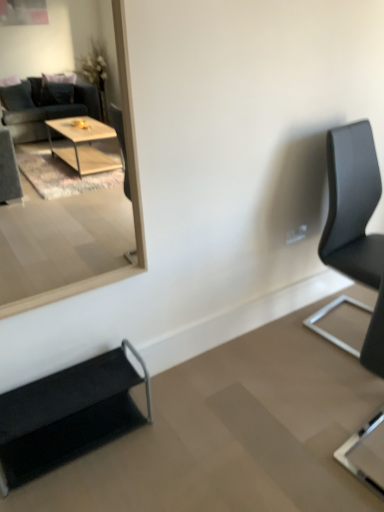
Question: Is black leather chair at right, positioned as the third chair in left-to-right order, smaller than black fabric chair at lower left, marked as the 1th chair in a left-to-right arrangement?

Choices:
 (A) no
 (B) yes

Answer: (A)

Question: Is black leather chair at right, the first chair from the right, wider than black fabric chair at lower left, the 3th chair positioned from the right?

Choices:
 (A) yes
 (B) no

Answer: (A)

Question: Is black leather chair at right, the first chair from the right, further to the viewer compared to black fabric chair at lower left, the 3th chair positioned from the right?

Choices:
 (A) yes
 (B) no

Answer: (A)

Question: Is black leather chair at right, positioned as the third chair in left-to-right order, to the right of black fabric chair at lower left, marked as the 1th chair in a left-to-right arrangement, from the viewer's perspective?

Choices:
 (A) yes
 (B) no

Answer: (A)

Question: From a real-world perspective, is black leather chair at right, positioned as the third chair in left-to-right order, under black fabric chair at lower left, the 3th chair positioned from the right?

Choices:
 (A) no
 (B) yes

Answer: (A)

Question: Is black leather chair at right, positioned as the third chair in left-to-right order, bigger than black fabric chair at lower left, the 3th chair positioned from the right?

Choices:
 (A) yes
 (B) no

Answer: (A)

Question: Does black leather chair at right, the first chair from the right, have a greater width compared to wooden frame mirror at upper left?

Choices:
 (A) no
 (B) yes

Answer: (B)

Question: Does black leather chair at right, positioned as the third chair in left-to-right order, come behind wooden frame mirror at upper left?

Choices:
 (A) no
 (B) yes

Answer: (B)

Question: Is black leather chair at right, positioned as the third chair in left-to-right order, to the right of wooden frame mirror at upper left from the viewer's perspective?

Choices:
 (A) no
 (B) yes

Answer: (B)

Question: From a real-world perspective, is black leather chair at right, positioned as the third chair in left-to-right order, positioned under wooden frame mirror at upper left based on gravity?

Choices:
 (A) yes
 (B) no

Answer: (A)

Question: Is black leather chair at right, the first chair from the right, outside of wooden frame mirror at upper left?

Choices:
 (A) yes
 (B) no

Answer: (A)

Question: Is black leather chair at right, positioned as the third chair in left-to-right order, smaller than wooden frame mirror at upper left?

Choices:
 (A) no
 (B) yes

Answer: (A)

Question: Is the position of wooden frame mirror at upper left more distant than that of black leather chair at right, the first chair from the right?

Choices:
 (A) yes
 (B) no

Answer: (B)